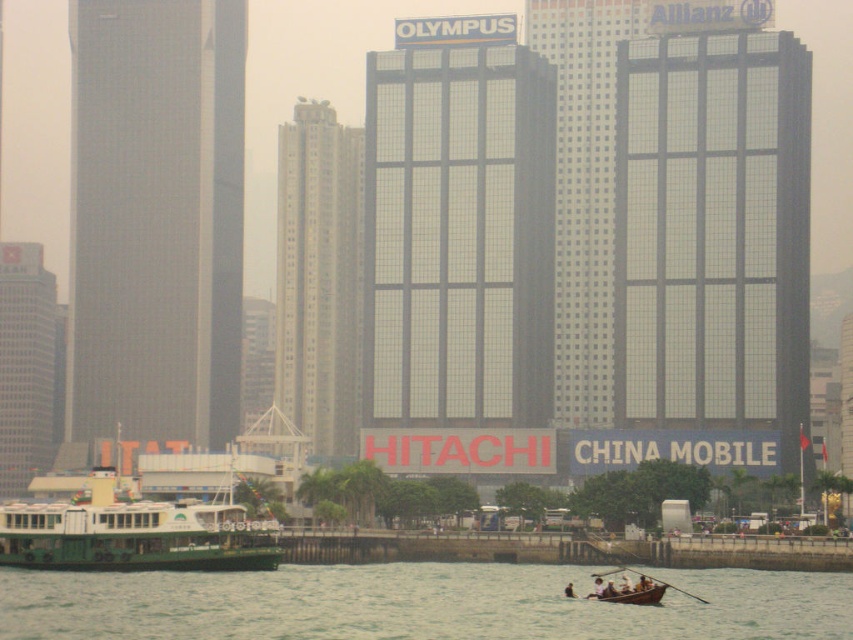
Does green matte ferryboat at lower left have a lesser height compared to wooden canoe at lower center?

In fact, green matte ferryboat at lower left may be taller than wooden canoe at lower center.

What do you see at coordinates (135, 534) in the screenshot?
I see `green matte ferryboat at lower left` at bounding box center [135, 534].

This screenshot has width=853, height=640. In order to click on green matte ferryboat at lower left in this screenshot , I will do `click(135, 534)`.

Is wooden canoe at lower center below wooden at lower right?

Incorrect, wooden canoe at lower center is not positioned below wooden at lower right.

Between point (654, 588) and point (624, 566), which one is positioned in front?

Positioned in front is point (654, 588).

The width and height of the screenshot is (853, 640). I want to click on wooden canoe at lower center, so click(631, 595).

Can you confirm if green water at lower center is bigger than wooden at lower right?

Yes, green water at lower center is bigger than wooden at lower right.

Is green water at lower center further to camera compared to wooden at lower right?

No, it is in front of wooden at lower right.

Is point (440, 618) closer to camera compared to point (676, 589)?

Yes, point (440, 618) is in front of point (676, 589).

This screenshot has width=853, height=640. Identify the location of green water at lower center. (415, 604).